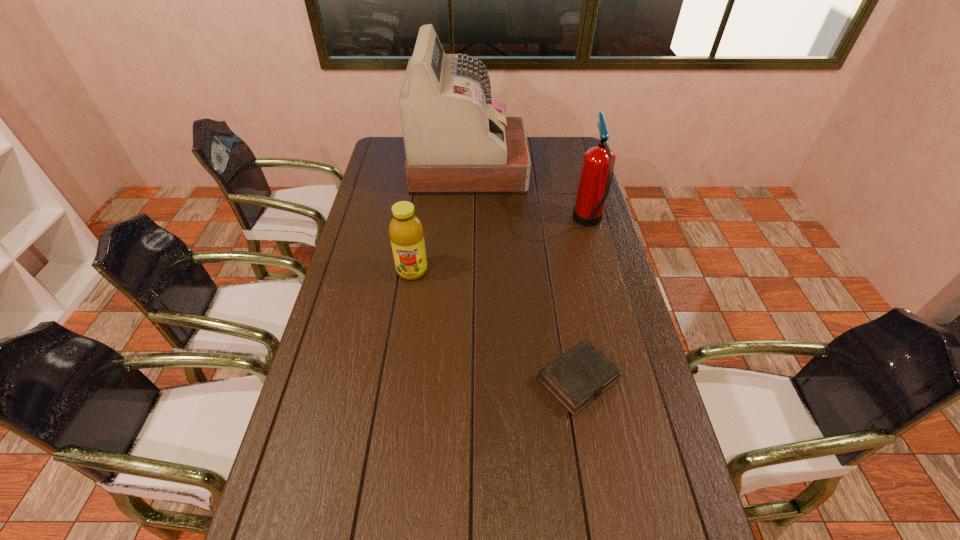
The width and height of the screenshot is (960, 540). I want to click on vacant space located on the front label of the third tallest object, so click(x=402, y=336).

Find the location of a particular element. The height and width of the screenshot is (540, 960). free region located on the front of the book is located at coordinates (596, 482).

This screenshot has height=540, width=960. In order to click on object positioned at the far edge in this screenshot , I will do (x=457, y=141).

At what (x,y) coordinates should I click in order to perform the action: click on fire extinguisher that is at the right edge. Please return your answer as a coordinate pair (x, y). The height and width of the screenshot is (540, 960). Looking at the image, I should click on (597, 170).

Where is `book present at the right edge`? The image size is (960, 540). book present at the right edge is located at coordinates (579, 376).

In the image, there is a desktop. At what (x,y) coordinates should I click in order to perform the action: click on blank space at the left edge. Please return your answer as a coordinate pair (x, y). Looking at the image, I should click on (360, 215).

Where is `vacant position at the right edge of the desktop`? Image resolution: width=960 pixels, height=540 pixels. vacant position at the right edge of the desktop is located at coordinates (567, 176).

This screenshot has height=540, width=960. In order to click on vacant space at the far left corner in this screenshot , I will do `click(386, 158)`.

I want to click on empty space between the fruit juice and the tallest object, so click(441, 219).

The width and height of the screenshot is (960, 540). In order to click on vacant space that's between the second shortest object and the third shortest object in this screenshot , I will do `click(500, 247)`.